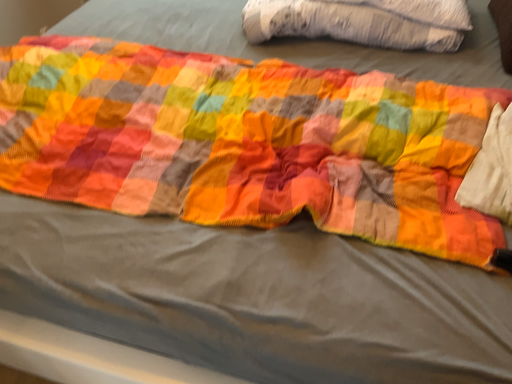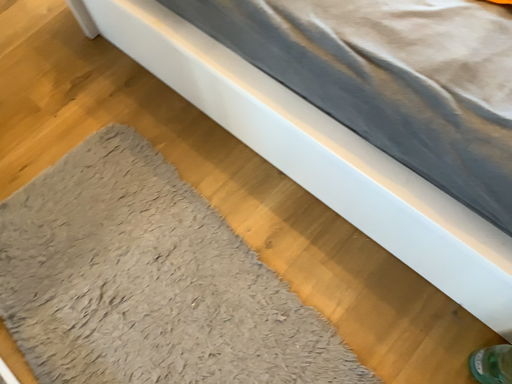
Question: Which way did the camera rotate in the video?

Choices:
 (A) rotated left
 (B) rotated right

Answer: (A)